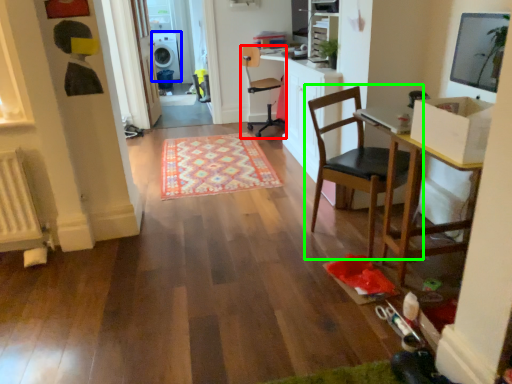
Question: Considering the real-world distances, which object is closest to chair (highlighted by a red box)? dish washer (highlighted by a blue box) or chair (highlighted by a green box).

Choices:
 (A) dish washer
 (B) chair

Answer: (B)